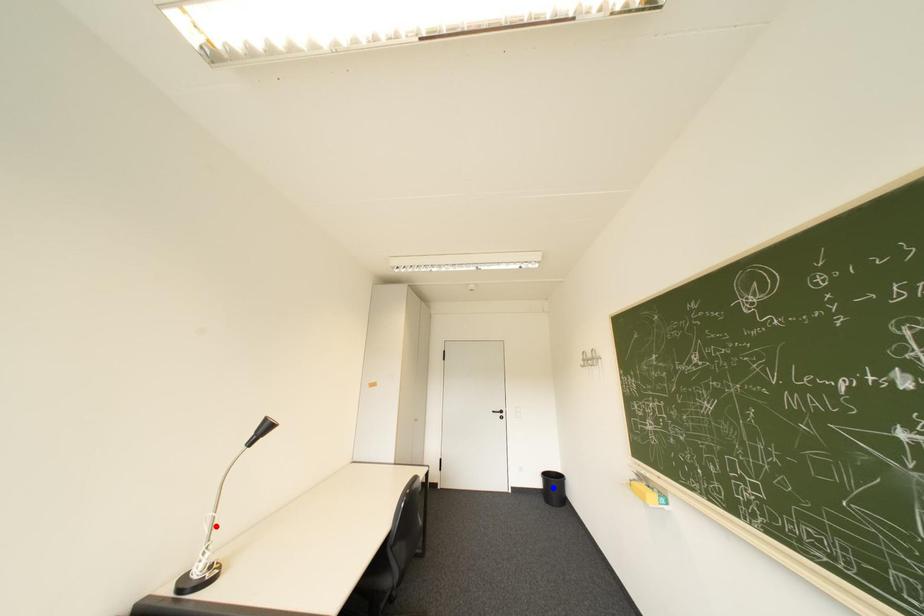
Question: Two points are marked on the image. Which point is closer to the camera?

Choices:
 (A) Blue point is closer.
 (B) Red point is closer.

Answer: (B)